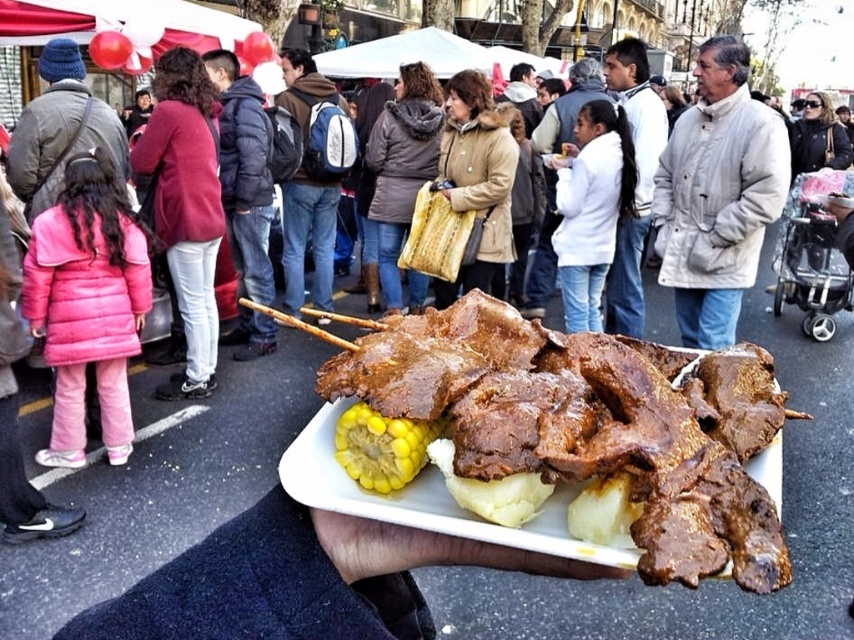
You are at the center of the image and want to reach the brown glossy meat at center. Which direction should you move to get closer to it?

The brown glossy meat at center is already at the center of the image, so you don not need to move in any direction to reach it.

In the scene shown: You are holding a white rectangular tray with food items. There is a point at coordinate [589,422] on the brown glossy meat at center. If you want to place a new skewer of grilled meat on the tray, where should you place it to avoid overlapping with the brown glossy meat at center?

Place the new skewer of grilled meat on the tray away from the point at coordinate [589,422] where the brown glossy meat at center is located to prevent overlapping.